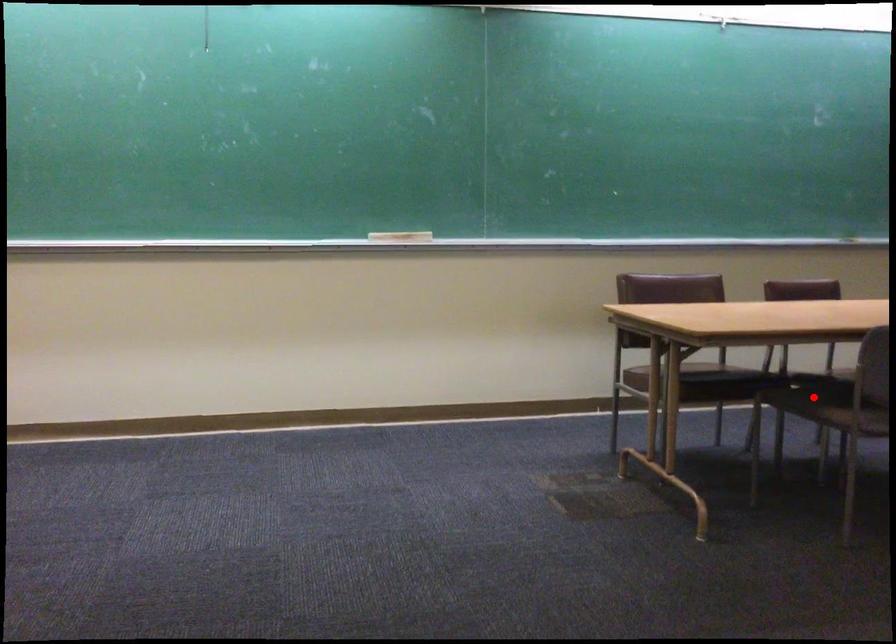
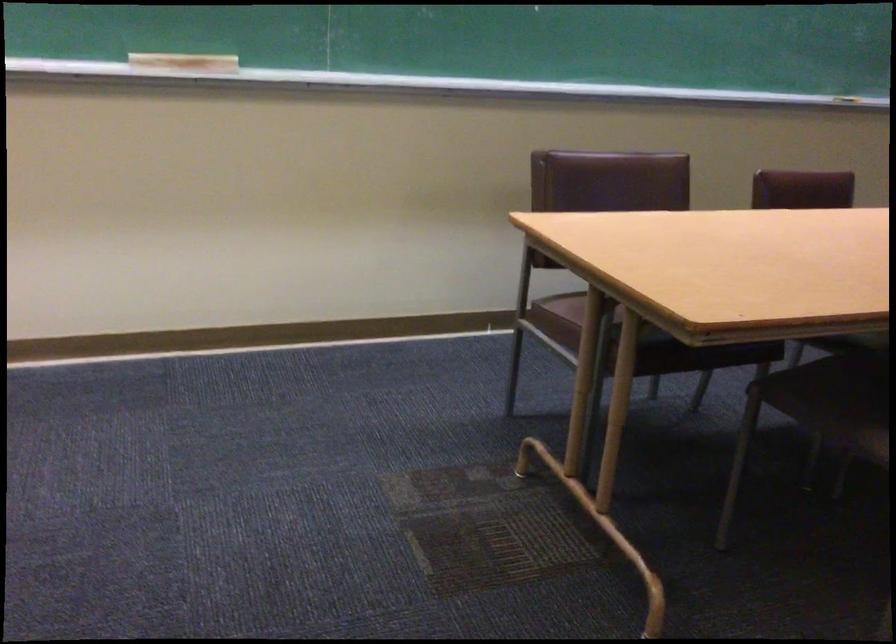
In the second image, find the point that corresponds to the highlighted location in the first image.

(833, 391)